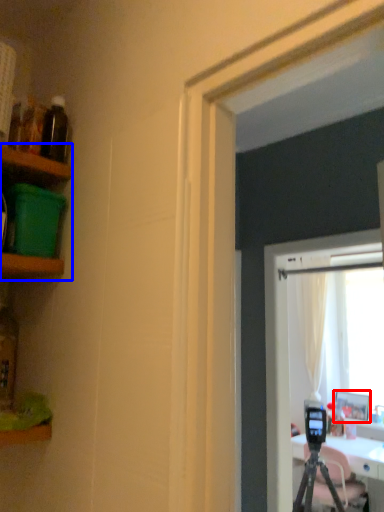
Question: Among these objects, which one is farthest to the camera, picture frame (highlighted by a red box) or shelf (highlighted by a blue box)?

Choices:
 (A) picture frame
 (B) shelf

Answer: (A)